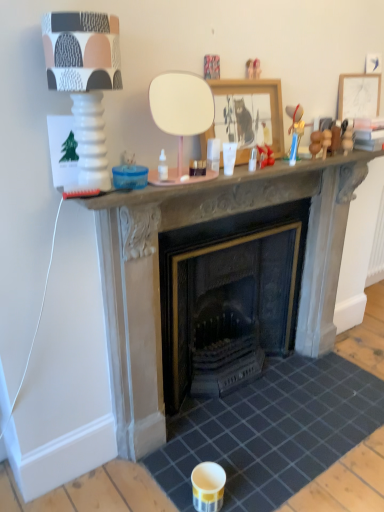
Question: Considering the positions of wooden framed picture at center, which appears as the first picture frame when viewed from the left, and stone fireplace at center in the image, is wooden framed picture at center, which appears as the first picture frame when viewed from the left, bigger or smaller than stone fireplace at center?

Choices:
 (A) small
 (B) big

Answer: (A)

Question: Relative to stone fireplace at center, is wooden framed picture at center, which appears as the first picture frame when viewed from the front, in front or behind?

Choices:
 (A) front
 (B) behind

Answer: (B)

Question: Estimate the real-world distances between objects in this image. Which object is farther from the dark gray tile at center?

Choices:
 (A) stone fireplace at center
 (B) matte wooden picture frame at upper right, positioned as the second picture frame in left-to-right order
 (C) matte white lamp at upper left
 (D) wooden framed picture at center, which ranks as the 2th picture frame in back-to-front order
 (E) white glossy coffee cup at upper center

Answer: (B)

Question: Which is farther from the white glossy coffee cup at upper center?

Choices:
 (A) stone fireplace at center
 (B) matte wooden picture frame at upper right, marked as the 1th picture frame in a right-to-left arrangement
 (C) dark gray tile at center
 (D) wooden framed picture at center, which appears as the first picture frame when viewed from the left
 (E) matte white lamp at upper left

Answer: (C)